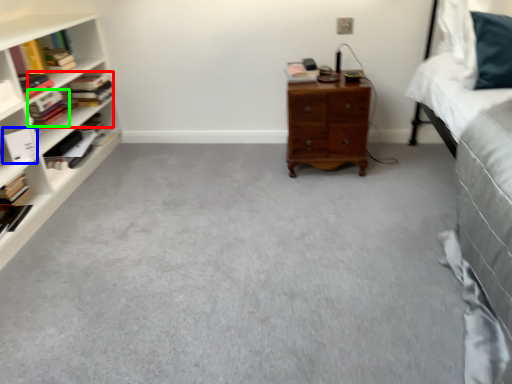
Question: Which is nearer to the book (highlighted by a red box)? book (highlighted by a blue box) or book (highlighted by a green box).

Choices:
 (A) book
 (B) book

Answer: (B)